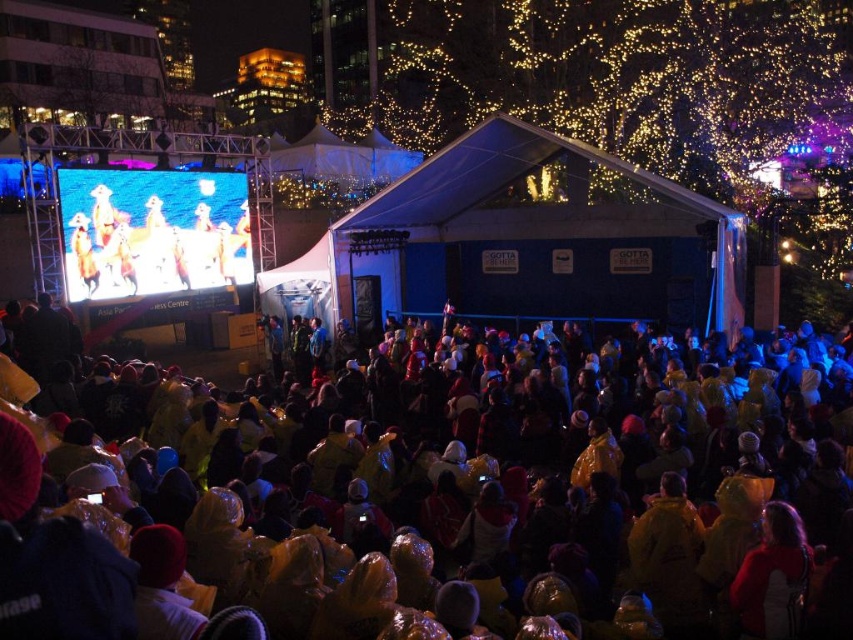
Question: Does yellow raincoats at lower center appear over matte black screen at upper left?

Choices:
 (A) yes
 (B) no

Answer: (B)

Question: Which point is closer to the camera taking this photo?

Choices:
 (A) (715, 582)
 (B) (67, 202)

Answer: (A)

Question: Which of the following is the closest to the observer?

Choices:
 (A) (761, 368)
 (B) (115, 228)

Answer: (A)

Question: Considering the relative positions of yellow raincoats at lower center and matte black screen at upper left in the image provided, where is yellow raincoats at lower center located with respect to matte black screen at upper left?

Choices:
 (A) below
 (B) above

Answer: (A)

Question: Which point is farther to the camera?

Choices:
 (A) yellow raincoats at lower center
 (B) matte black screen at upper left

Answer: (B)

Question: Does yellow raincoats at lower center have a smaller size compared to matte black screen at upper left?

Choices:
 (A) yes
 (B) no

Answer: (B)